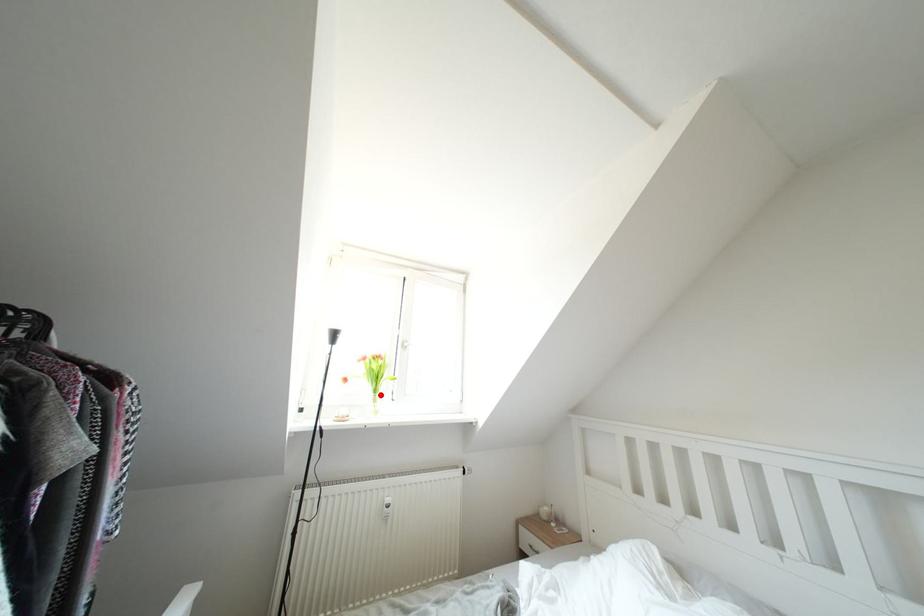
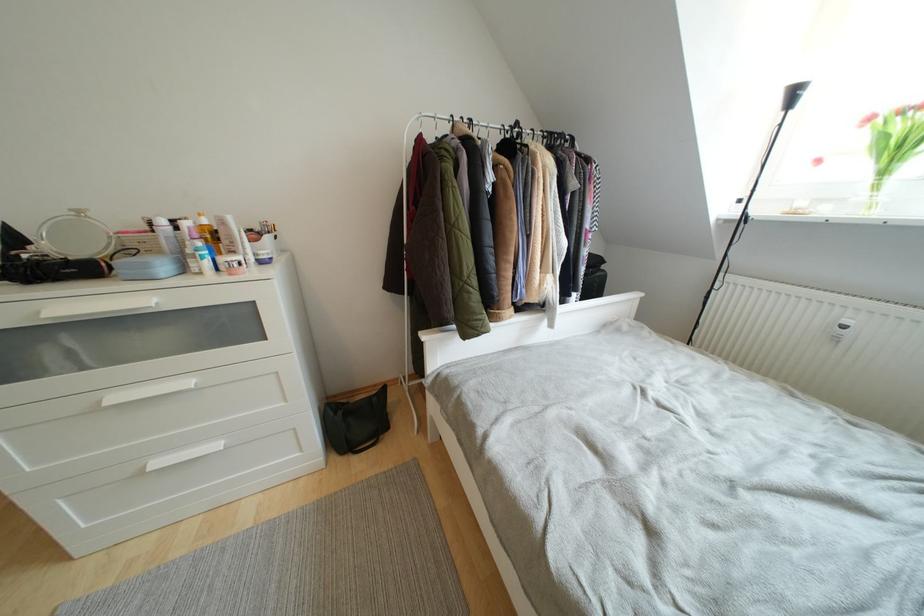
Question: I am providing you with two images of the same scene from different viewpoints. Given a red point in image1, look at the same physical point in image2. Is it:

Choices:
 (A) Closer to the viewpoint
 (B) Farther from the viewpoint

Answer: (B)